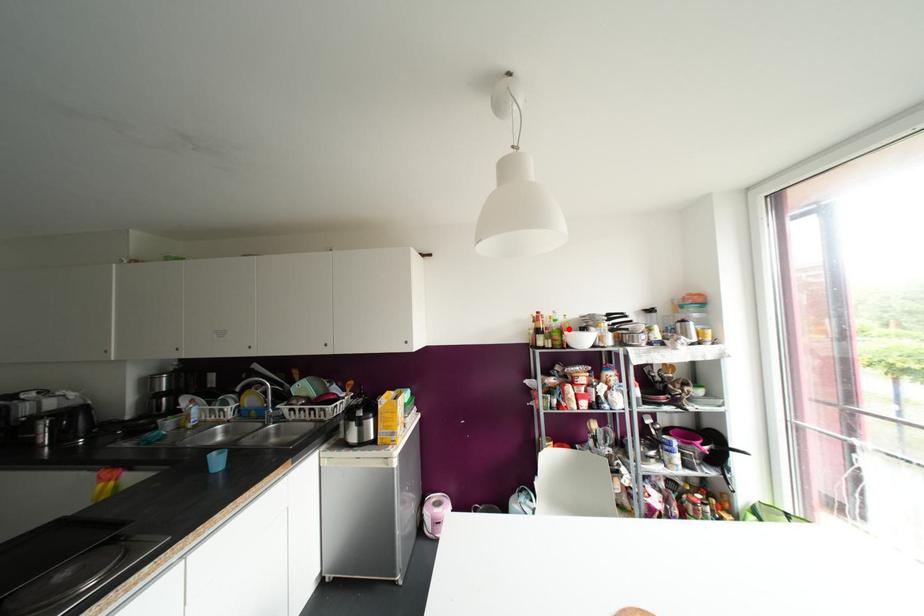
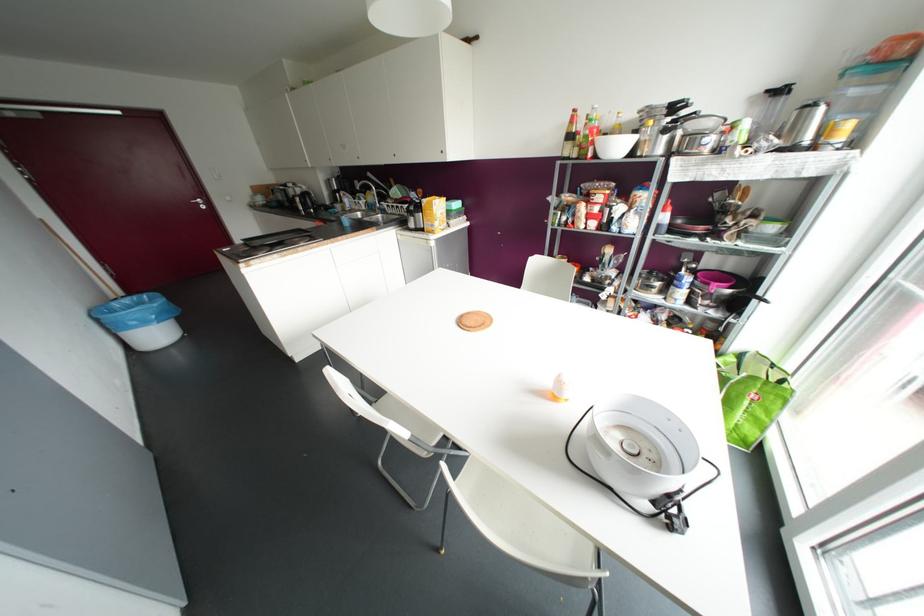
Locate, in the second image, the point that corresponds to the highlighted location in the first image.

(618, 134)